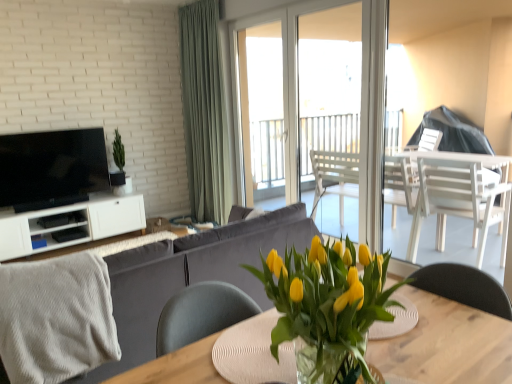
Question: Does translucent glass vase at center have a greater height compared to green fabric curtain at center?

Choices:
 (A) yes
 (B) no

Answer: (B)

Question: Does translucent glass vase at center have a lesser height compared to green fabric curtain at center?

Choices:
 (A) no
 (B) yes

Answer: (B)

Question: From the image's perspective, is translucent glass vase at center under green fabric curtain at center?

Choices:
 (A) yes
 (B) no

Answer: (A)

Question: Is translucent glass vase at center wider than green fabric curtain at center?

Choices:
 (A) no
 (B) yes

Answer: (A)

Question: Considering the relative sizes of translucent glass vase at center and green fabric curtain at center in the image provided, is translucent glass vase at center thinner than green fabric curtain at center?

Choices:
 (A) no
 (B) yes

Answer: (B)

Question: Is translucent glass vase at center positioned beyond the bounds of green fabric curtain at center?

Choices:
 (A) no
 (B) yes

Answer: (B)

Question: From a real-world perspective, does velvet grey couch at center stand above matte black tv at left?

Choices:
 (A) yes
 (B) no

Answer: (B)

Question: Considering the relative sizes of velvet grey couch at center and matte black tv at left in the image provided, is velvet grey couch at center taller than matte black tv at left?

Choices:
 (A) no
 (B) yes

Answer: (B)

Question: Is velvet grey couch at center not inside matte black tv at left?

Choices:
 (A) no
 (B) yes

Answer: (B)

Question: Does velvet grey couch at center have a lesser width compared to matte black tv at left?

Choices:
 (A) no
 (B) yes

Answer: (A)

Question: Is velvet grey couch at center bigger than matte black tv at left?

Choices:
 (A) no
 (B) yes

Answer: (B)

Question: Does velvet grey couch at center have a greater width compared to matte black tv at left?

Choices:
 (A) yes
 (B) no

Answer: (A)

Question: Is wooden table at center wider than transparent glass door at center?

Choices:
 (A) no
 (B) yes

Answer: (B)